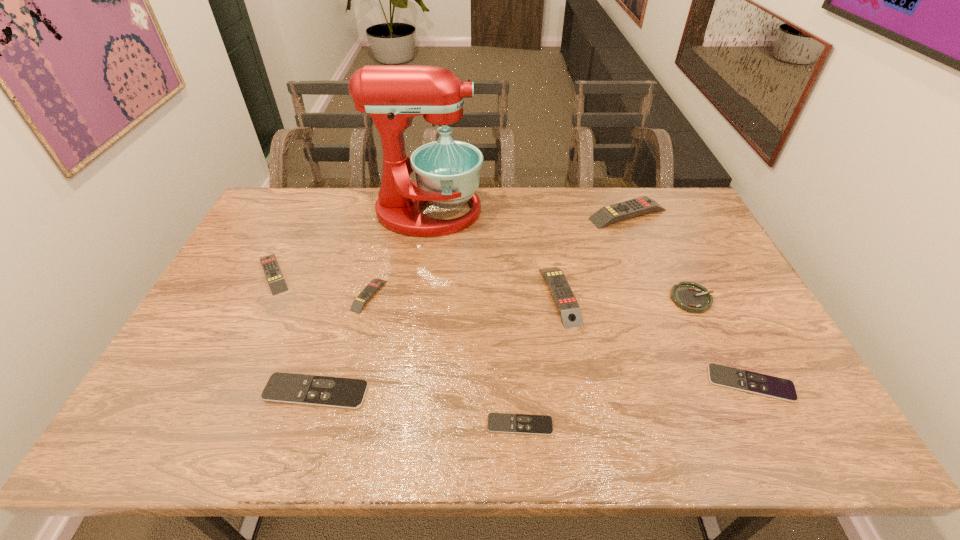
The height and width of the screenshot is (540, 960). In order to click on vacant space located 0.080m on the back of the leftmost remote control in this screenshot , I will do `click(291, 238)`.

This screenshot has height=540, width=960. I want to click on free location located 0.390m on the left of the ashtray, so click(x=535, y=299).

Image resolution: width=960 pixels, height=540 pixels. I want to click on vacant space located 0.300m on the left of the second yellow remote control from left to right, so point(251,295).

This screenshot has height=540, width=960. In order to click on free space located on the left of the leftmost black remote control in this screenshot , I will do `click(206, 392)`.

The width and height of the screenshot is (960, 540). I want to click on blank space located 0.160m on the left of the second biggest black remote control, so click(x=644, y=383).

Where is `vacant space located 0.170m on the back of the nearest remote control`? This screenshot has width=960, height=540. vacant space located 0.170m on the back of the nearest remote control is located at coordinates (515, 354).

Find the location of `mixer present at the far edge`. mixer present at the far edge is located at coordinates (447, 172).

Identify the location of remote control situated at the far edge. Image resolution: width=960 pixels, height=540 pixels. (609, 214).

This screenshot has width=960, height=540. Identify the location of object that is at the near edge. (497, 422).

Where is `object that is at the left edge`? The width and height of the screenshot is (960, 540). object that is at the left edge is located at coordinates (277, 284).